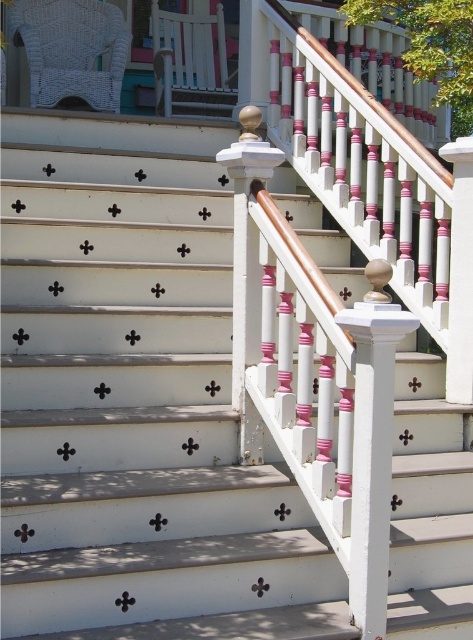
Looking at this image, which is below, white wicker rocking chair at upper left or white painted wood balustrade at upper center?

white wicker rocking chair at upper left

Is point (70, 72) behind point (184, 84)?

No.

Who is more forward, (106, 38) or (154, 12)?

Point (106, 38) is in front.

You are a GUI agent. You are given a task and a screenshot of the screen. Output one action in this format:
    pyautogui.click(x=<x>, y=<y>)
    Task: Click on the white wicker rocking chair at upper left
    The height and width of the screenshot is (640, 473).
    Given the screenshot: What is the action you would take?
    pyautogui.click(x=71, y=51)